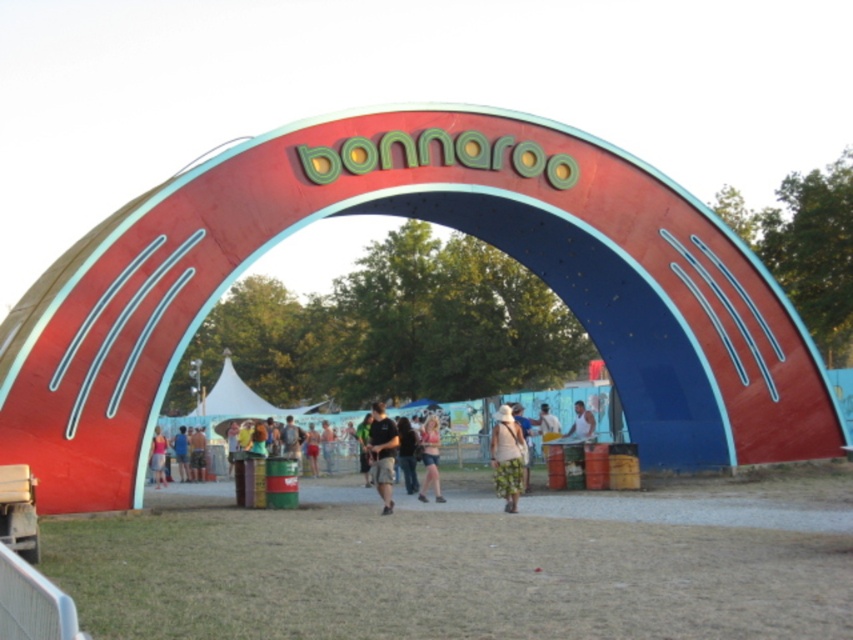
Question: Can you confirm if matte pink shorts at center is wider than light brown wooden table at center?

Choices:
 (A) no
 (B) yes

Answer: (B)

Question: Can you confirm if light brown wooden table at center is positioned below blue denim shorts at center?

Choices:
 (A) no
 (B) yes

Answer: (A)

Question: Which point is farther from the camera taking this photo?

Choices:
 (A) (437, 499)
 (B) (576, 413)
 (C) (508, 424)
 (D) (172, 448)

Answer: (D)

Question: Which of the following is the farthest from the observer?

Choices:
 (A) (177, 448)
 (B) (386, 456)
 (C) (583, 435)

Answer: (A)

Question: Which point appears closest to the camera in this image?

Choices:
 (A) (503, 472)
 (B) (155, 436)

Answer: (A)

Question: Where is black cotton shirt at center located in relation to matte pink shorts at center in the image?

Choices:
 (A) below
 (B) above

Answer: (A)